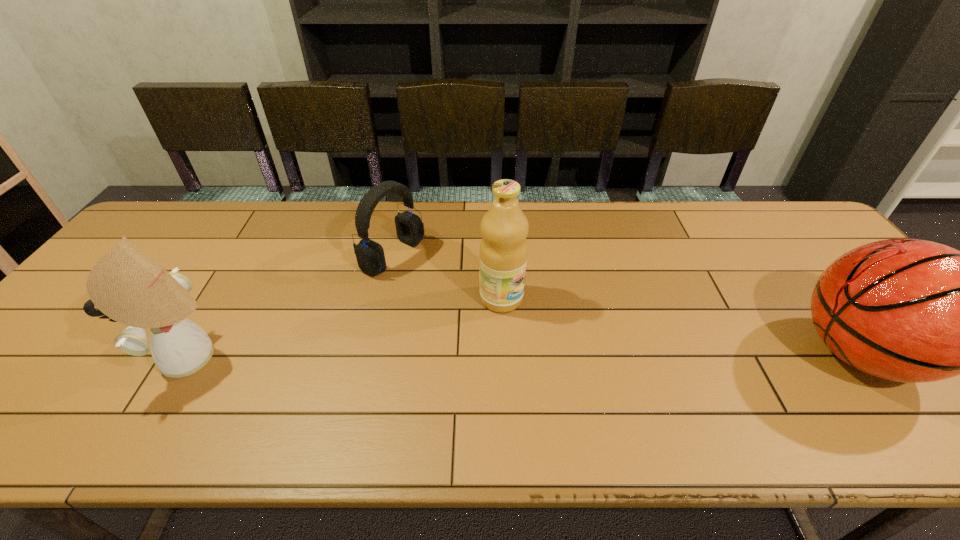
Where is `free spot located on the label of the second object from right to left`? The image size is (960, 540). free spot located on the label of the second object from right to left is located at coordinates (628, 367).

Identify the location of vacant space located on the label of the second object from right to left. The height and width of the screenshot is (540, 960). (623, 364).

The height and width of the screenshot is (540, 960). Find the location of `free region located on the label of the second object from right to left`. free region located on the label of the second object from right to left is located at coordinates click(x=566, y=334).

Where is `object located at the far edge`? object located at the far edge is located at coordinates (370, 256).

Identify the location of object that is at the near edge. (126, 285).

In the image, there is a desktop. At what (x,y) coordinates should I click in order to perform the action: click on vacant space at the far edge. Please return your answer as a coordinate pair (x, y). Looking at the image, I should click on (226, 245).

Where is `vacant space at the near edge of the desktop`? vacant space at the near edge of the desktop is located at coordinates (719, 401).

Identify the location of blank space at the far left corner of the desktop. (160, 232).

In the image, there is a desktop. Identify the location of free region at the far right corner. The width and height of the screenshot is (960, 540). (778, 244).

Where is `blank region between the second object from left to right and the third object from left to right`? Image resolution: width=960 pixels, height=540 pixels. blank region between the second object from left to right and the third object from left to right is located at coordinates (447, 277).